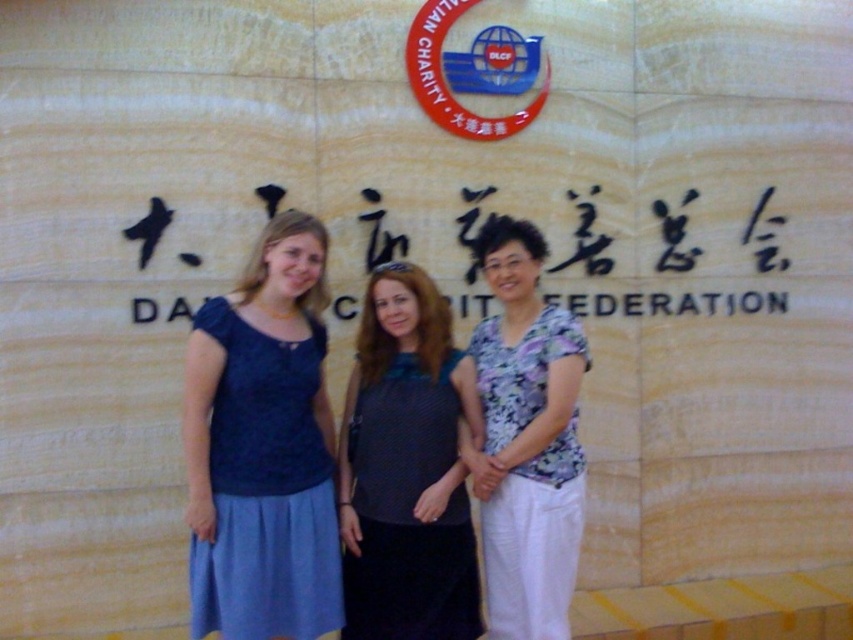
Between point (277, 525) and point (576, 336), which one is positioned in front?

Point (277, 525) is in front.

Between blue satin dress at left and floral fabric blouse at center, which one appears on the right side from the viewer's perspective?

From the viewer's perspective, floral fabric blouse at center appears more on the right side.

Who is more distant from viewer, (x=218, y=608) or (x=527, y=316)?

The point (x=527, y=316) is behind.

The width and height of the screenshot is (853, 640). In order to click on blue satin dress at left in this screenshot , I will do `click(263, 448)`.

Does matte gray top at center appear on the left side of floral fabric blouse at center?

Indeed, matte gray top at center is positioned on the left side of floral fabric blouse at center.

Between matte gray top at center and floral fabric blouse at center, which one is positioned lower?

Positioned lower is matte gray top at center.

This screenshot has height=640, width=853. Identify the location of matte gray top at center. [405, 468].

You are a GUI agent. You are given a task and a screenshot of the screen. Output one action in this format:
    pyautogui.click(x=<x>, y=<y>)
    Task: Click on the matte gray top at center
    
    Given the screenshot: What is the action you would take?
    pyautogui.click(x=405, y=468)

Which is below, blue satin dress at left or matte gray top at center?

matte gray top at center is below.

Who is more distant from viewer, (260, 588) or (367, 504)?

The point (367, 504) is more distant.

Which is in front, point (247, 272) or point (363, 417)?

Point (363, 417) is more forward.

You are a GUI agent. You are given a task and a screenshot of the screen. Output one action in this format:
    pyautogui.click(x=<x>, y=<y>)
    Task: Click on the blue satin dress at left
    This screenshot has height=640, width=853.
    Given the screenshot: What is the action you would take?
    pyautogui.click(x=263, y=448)